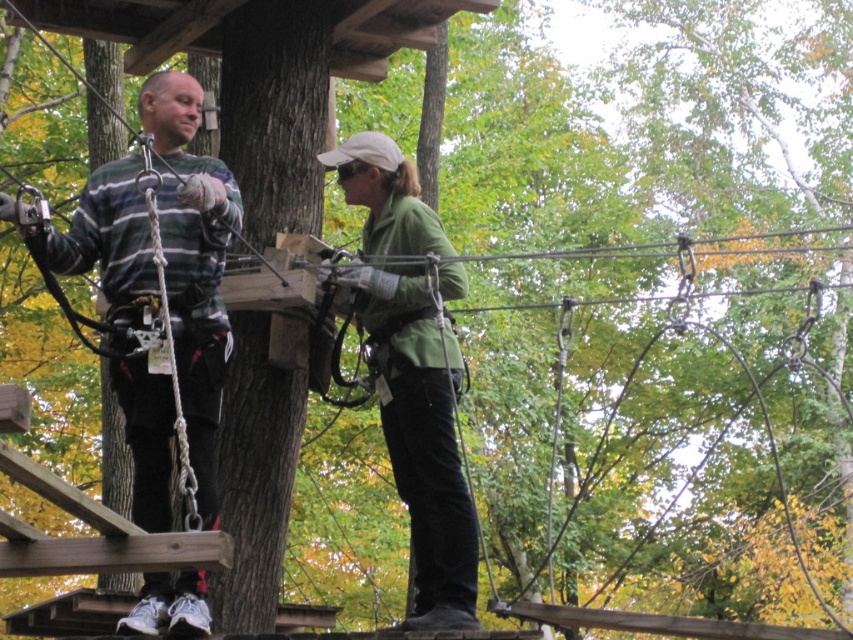
Does striped sweater at left appear over green matte jacket at center?

Yes.

Who is positioned more to the left, striped sweater at left or green matte jacket at center?

Positioned to the left is striped sweater at left.

Does point (173, 588) come farther from viewer compared to point (440, 296)?

No, it is not.

The width and height of the screenshot is (853, 640). I want to click on striped sweater at left, so (x=166, y=253).